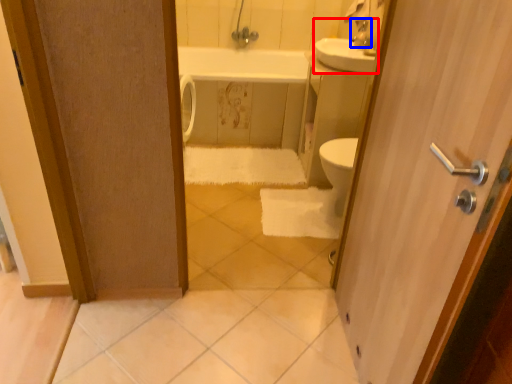
Question: Among these objects, which one is farthest to the camera, sink (highlighted by a red box) or faucet (highlighted by a blue box)?

Choices:
 (A) sink
 (B) faucet

Answer: (B)